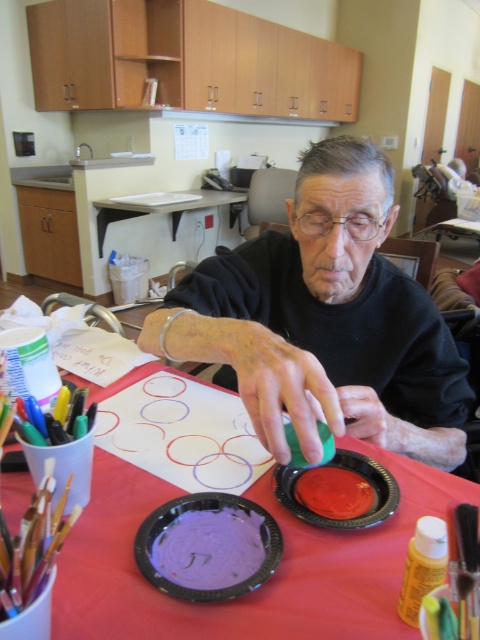
Looking at this image, you are standing in front of the table where the elderly person is painting. You need to reach the point at coordinate (x=195, y=534) on the table to place a new paintbrush. If your arm can extend 20 inches, will you be able to reach that point without moving closer?

The point at coordinate (x=195, y=534) is 19.57 inches away from the camera, so yes, your arm can reach it since it is within the 20 inches extension range.

You are an art instructor observing an elderly participant in a painting session. You notice the matte black shirt at center and the purple matte paper plate at center. Which object is positioned to the left?

The purple matte paper plate at center is positioned to the left of the matte black shirt at center.

You are a delivery robot with a 12 inch wide package. You need to navigate to the point marked at coordinates point (324, 380) in the image. Can you safely deliver the package to that point without moving closer than 12 inches to any objects?

The distance between point (324, 380) and the camera is 20.14 inches. Since the package is 12 inches wide, you can safely deliver it as the distance is sufficient.